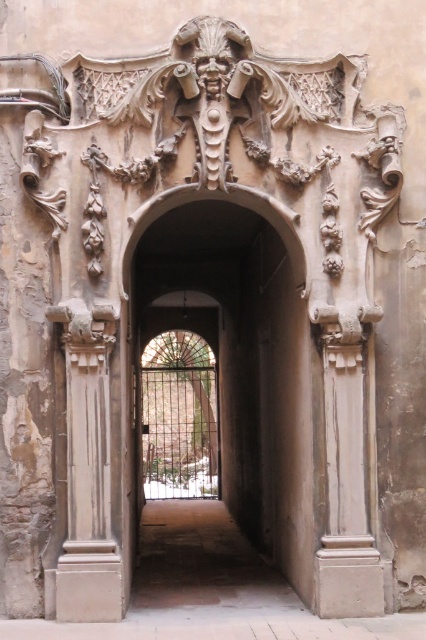
Is beige stone column at left below smooth stone column at right?

No, beige stone column at left is not below smooth stone column at right.

Is point (114, 579) in front of point (357, 522)?

Yes.

Where is `beige stone column at left`? The image size is (426, 640). beige stone column at left is located at coordinates (88, 474).

Is smooth stone archway at center above smooth stone column at right?

Yes.

Is smooth stone archway at center wider than smooth stone column at right?

Yes.

Is point (310, 532) less distant than point (359, 388)?

No, (310, 532) is behind (359, 388).

At what (x,y) coordinates should I click in order to perform the action: click on smooth stone archway at center. Please return your answer as a coordinate pair (x, y). The width and height of the screenshot is (426, 640). Looking at the image, I should click on (242, 364).

Who is higher up, smooth stone archway at center or beige stone column at left?

smooth stone archway at center is above.

Is smooth stone archway at center positioned before beige stone column at left?

No, smooth stone archway at center is further to the viewer.

Does point (296, 563) come behind point (89, 608)?

That is True.

Find the location of a particular element. This screenshot has width=426, height=640. smooth stone archway at center is located at coordinates (242, 364).